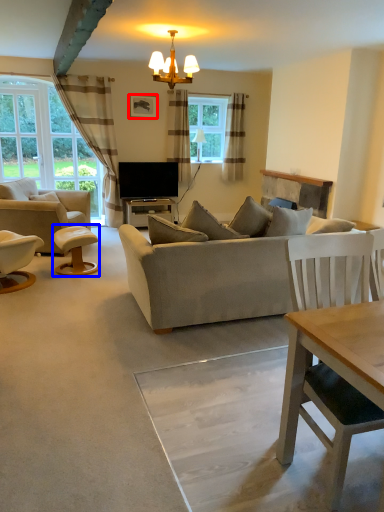
Question: Which object is closer to the camera taking this photo, picture frame (highlighted by a red box) or stool (highlighted by a blue box)?

Choices:
 (A) picture frame
 (B) stool

Answer: (B)